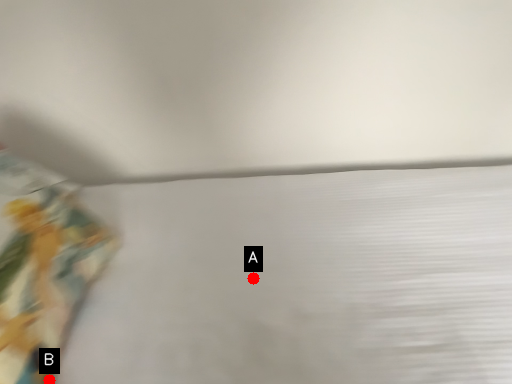
Question: Two points are circled on the image, labeled by A and B beside each circle. Which point is farther to the camera?

Choices:
 (A) A is further
 (B) B is further

Answer: (A)